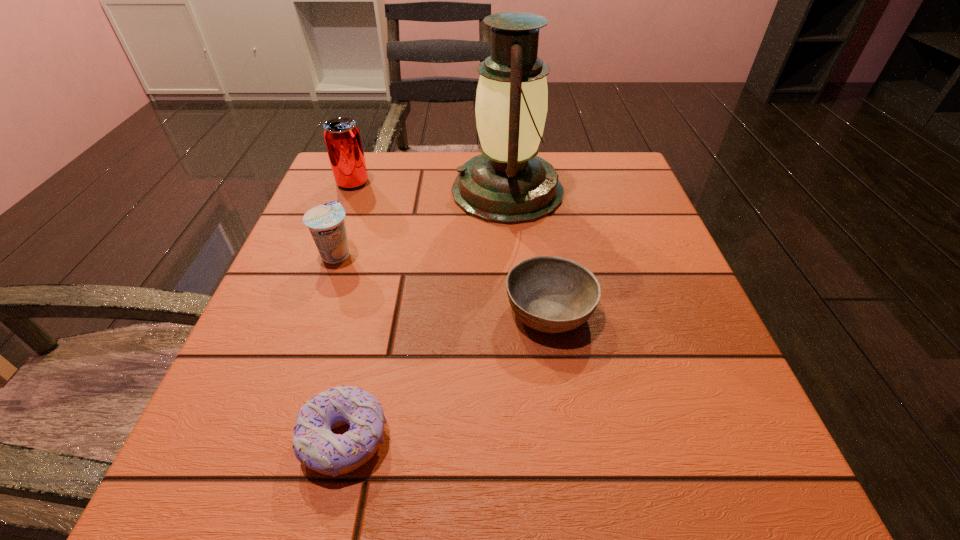
Find the location of a particular element. The image size is (960, 540). lantern is located at coordinates (508, 184).

Where is `soda can`? The width and height of the screenshot is (960, 540). soda can is located at coordinates (342, 137).

Image resolution: width=960 pixels, height=540 pixels. What are the coordinates of `yogurt` in the screenshot? It's located at (x=326, y=223).

Locate an element on the screen. the third tallest object is located at coordinates (326, 223).

Locate an element on the screen. the fourth farthest object is located at coordinates (551, 294).

At what (x,y) coordinates should I click in order to perform the action: click on doughnut. Please return your answer as a coordinate pair (x, y). The width and height of the screenshot is (960, 540). Looking at the image, I should click on (314, 444).

This screenshot has height=540, width=960. Identify the location of the third object from right to left. (314, 444).

Find the location of `free region located with the light compartment facing forward on the tallest object`. free region located with the light compartment facing forward on the tallest object is located at coordinates (385, 191).

You are a GUI agent. You are given a task and a screenshot of the screen. Output one action in this format:
    pyautogui.click(x=<x>, y=<y>)
    Task: Click on the free space located with the light compartment facing forward on the tallest object
    Image resolution: width=960 pixels, height=540 pixels.
    Given the screenshot: What is the action you would take?
    pyautogui.click(x=425, y=191)

Find the location of a particular element. vacant space located 0.090m with the light compartment facing forward on the tallest object is located at coordinates (412, 191).